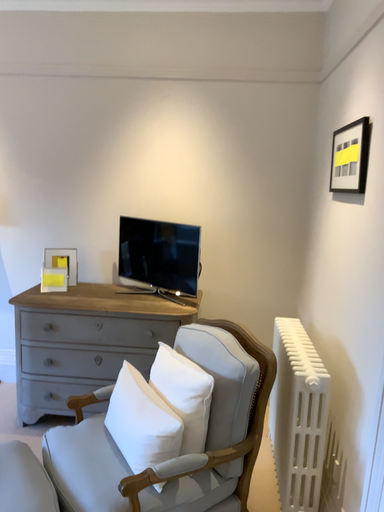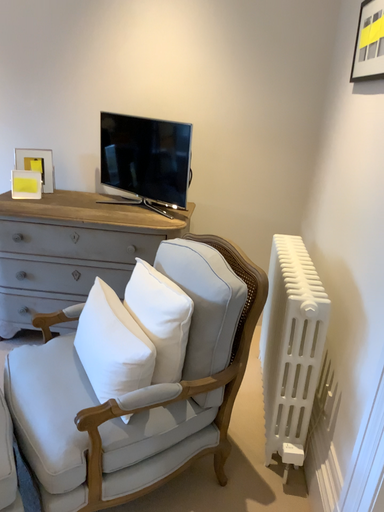
Question: Which way did the camera rotate in the video?

Choices:
 (A) rotated downward
 (B) rotated upward

Answer: (A)